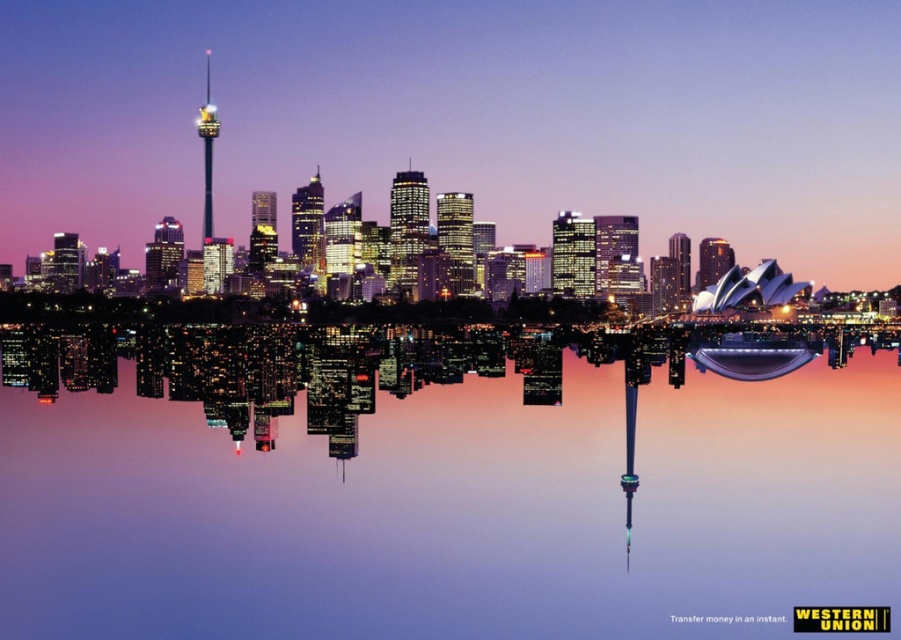
You are standing on a bridge overlooking the transparent glass water at center and the shiny glass tower at center. Which object would appear larger to you based on their positions?

The transparent glass water at center would appear larger because it is closer to the viewer than the shiny glass tower at center.

You are a city planner evaluating the proposed location of a new observation deck. The deck must be placed on the taller structure between the transparent glass water at center and the shiny glass tower at center. Which structure should you choose?

The transparent glass water at center is much taller than the shiny glass tower at center, so the observation deck should be placed on the transparent glass water at center.

You are standing on a bridge overlooking the transparent glass water at center and the shiny glass tower at center. Which object is closer to the ground?

The transparent glass water at center is located below the shiny glass tower at center, so it is closer to the ground than the tower.